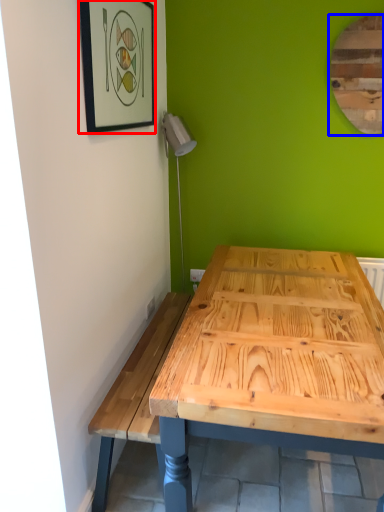
Question: Which point is further to the camera, picture frame (highlighted by a red box) or mirror (highlighted by a blue box)?

Choices:
 (A) picture frame
 (B) mirror

Answer: (B)